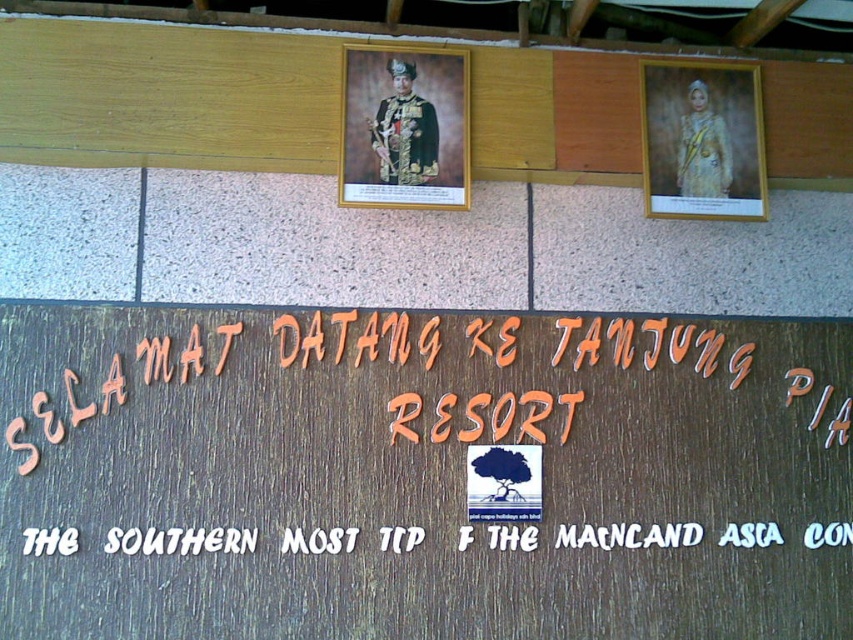
Is wooden signboard at center shorter than gold textured fabric at upper right?

In fact, wooden signboard at center may be taller than gold textured fabric at upper right.

Between wooden signboard at center and gold textured fabric at upper right, which one is positioned higher?

gold textured fabric at upper right is higher up.

Which is in front, point (610, 340) or point (724, 212)?

Point (724, 212)

Where is `wooden signboard at center`? This screenshot has width=853, height=640. wooden signboard at center is located at coordinates (421, 476).

Is point (387, 164) farther from camera compared to point (199, 536)?

Yes, point (387, 164) is farther from viewer.

Is point (460, 145) positioned in front of point (38, 541)?

No, (460, 145) is behind (38, 541).

Image resolution: width=853 pixels, height=640 pixels. Identify the location of gold textured uniform at upper center. [404, 128].

At what (x,y) coordinates should I click in order to perform the action: click on gold textured uniform at upper center. Please return your answer as a coordinate pair (x, y). The image size is (853, 640). Looking at the image, I should click on (404, 128).

Does gold textured fabric at upper right appear on the right side of white wood sign at lower center?

Correct, you'll find gold textured fabric at upper right to the right of white wood sign at lower center.

The image size is (853, 640). What do you see at coordinates (701, 140) in the screenshot? I see `gold textured fabric at upper right` at bounding box center [701, 140].

Where is `gold textured fabric at upper right`? Image resolution: width=853 pixels, height=640 pixels. gold textured fabric at upper right is located at coordinates (701, 140).